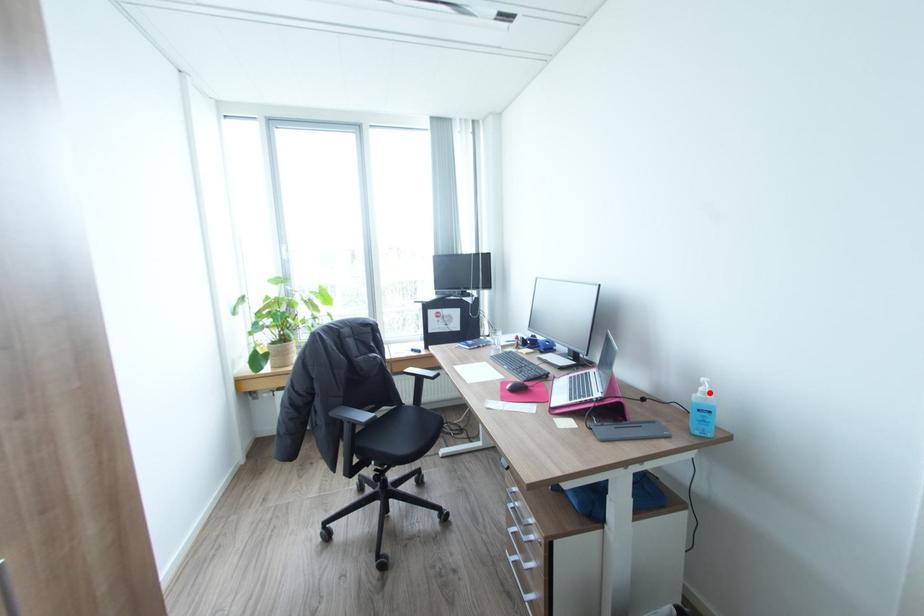
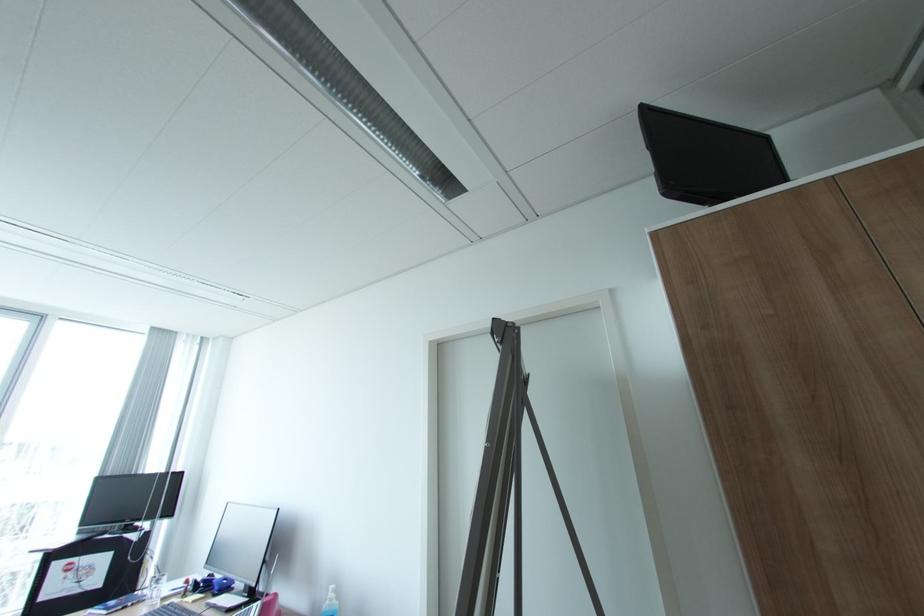
Where in the second image is the point corresponding to the highlighted location from the first image?

(336, 599)